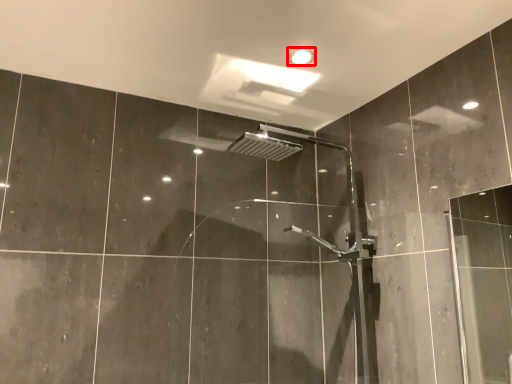
Question: In this image, where is light fixture (annotated by the red box) located relative to screen door?

Choices:
 (A) right
 (B) left

Answer: (B)